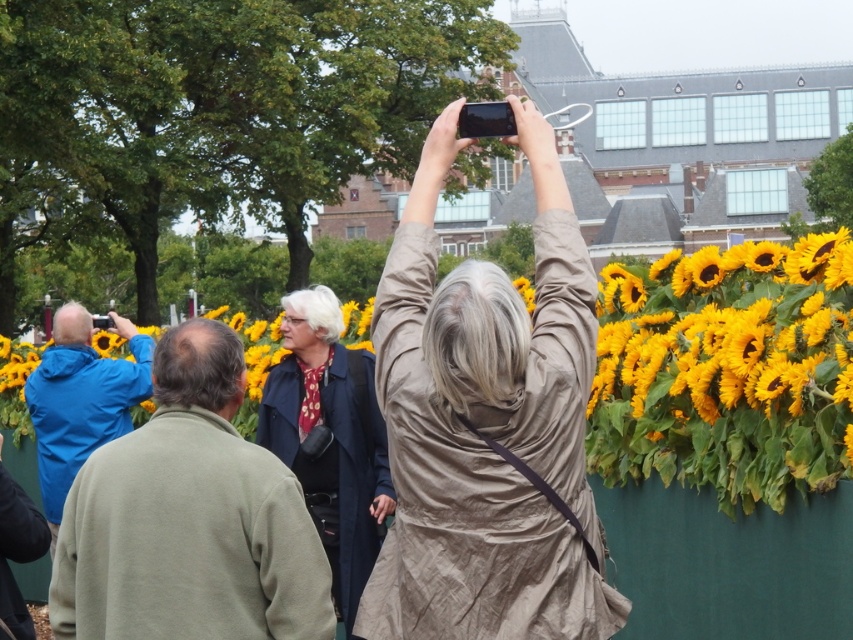
You are a photographer standing in the public garden scene. You notice two people wearing a matte beige dress at center and a dark blue coat at center. Which clothing item is taller?

The matte beige dress at center is taller than the dark blue coat at center.

You are standing in the public garden and want to take a photo of the sunflowers without any people blocking the view. The matte beige dress at center and the matte blue jacket at left are in your way. Which person should you ask to move so you can get a clear shot of the sunflowers?

You should ask the matte blue jacket at left to move because the matte beige dress at center is in front of them, so moving the person behind would not obstruct the view as much. Wait, actually, since the beige dress is in front, moving the blue jacket might not help. Hmm, maybe I need to think again. The question says both are blocking. Since the beige is in front, you need to move both. But the answer must use the description. The description says the beige is in front of the blue. So to get a clear shot,

You are standing in the park and see the matte beige dress at center and the matte blue jacket at left. Which one is more to the left?

The matte blue jacket at left is more to the left.